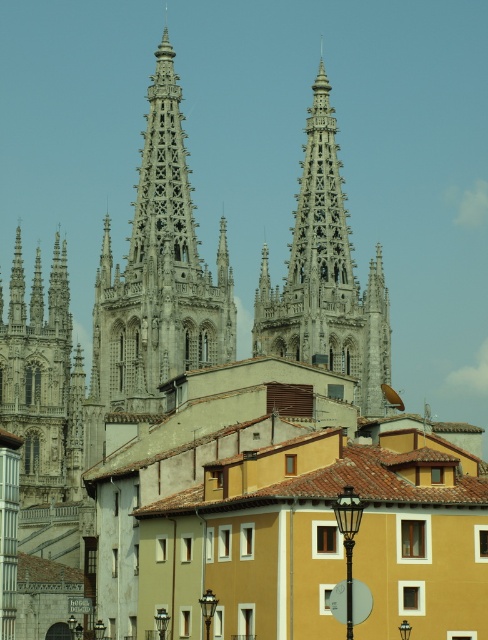
Does gray stone spire at center appear under gray stone tower at left?

Incorrect, gray stone spire at center is not positioned below gray stone tower at left.

Between gray stone spire at center and gray stone tower at left, which one has more height?

Standing taller between the two is gray stone spire at center.

Does point (185, 176) lie behind point (29, 472)?

Yes, point (185, 176) is behind point (29, 472).

Image resolution: width=488 pixels, height=640 pixels. What are the coordinates of `gray stone spire at center` in the screenshot? It's located at (156, 282).

Between point (325, 259) and point (47, 468), which one is positioned behind?

The point (325, 259) is more distant.

Does white stone spire at center have a greater height compared to gray stone tower at left?

Yes.

The height and width of the screenshot is (640, 488). What are the coordinates of `white stone spire at center` in the screenshot? It's located at (325, 276).

The image size is (488, 640). Identify the location of white stone spire at center. (325, 276).

From the picture: Which is above, gray stone spire at center or white stone spire at center?

white stone spire at center is above.

Can you confirm if gray stone spire at center is bigger than white stone spire at center?

Actually, gray stone spire at center might be smaller than white stone spire at center.

Is point (106, 387) positioned in front of point (326, 90)?

Yes.

What are the coordinates of `gray stone spire at center` in the screenshot? It's located at (156, 282).